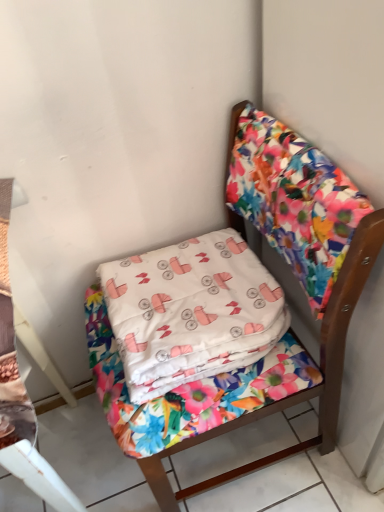
Question: Considering the positions of floral fabric chair at center and white fabric pillow at center in the image, is floral fabric chair at center bigger or smaller than white fabric pillow at center?

Choices:
 (A) big
 (B) small

Answer: (A)

Question: From a real-world perspective, is floral fabric chair at center positioned above or below white fabric pillow at center?

Choices:
 (A) below
 (B) above

Answer: (A)

Question: Is floral fabric chair at center wider or thinner than white fabric pillow at center?

Choices:
 (A) thin
 (B) wide

Answer: (B)

Question: Visually, is white fabric pillow at center positioned to the left or to the right of floral fabric chair at center?

Choices:
 (A) left
 (B) right

Answer: (A)

Question: Does point (205, 334) appear closer or farther from the camera than point (382, 225)?

Choices:
 (A) closer
 (B) farther

Answer: (B)

Question: Considering the positions of white fabric pillow at center and floral fabric chair at center in the image, is white fabric pillow at center wider or thinner than floral fabric chair at center?

Choices:
 (A) thin
 (B) wide

Answer: (A)

Question: From a real-world perspective, is white fabric pillow at center physically located above or below floral fabric chair at center?

Choices:
 (A) below
 (B) above

Answer: (B)